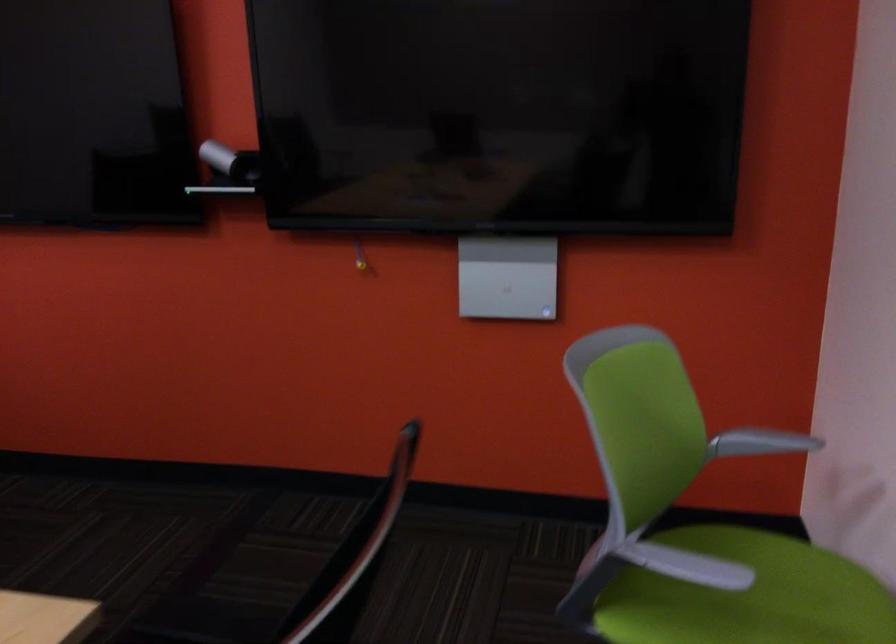
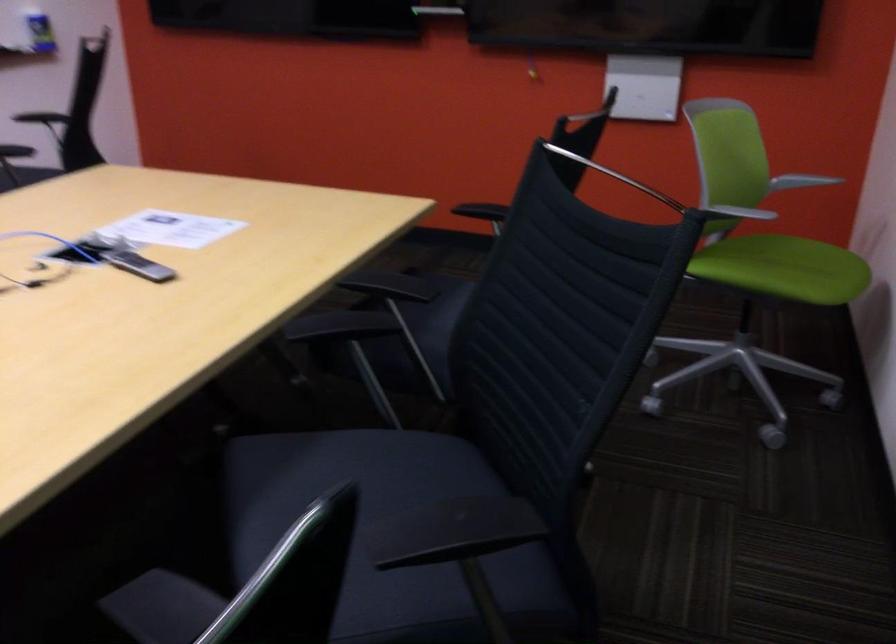
Question: What movement of the cameraman would produce the second image?

Choices:
 (A) Left
 (B) Right
 (C) Forward
 (D) Backward

Answer: (D)